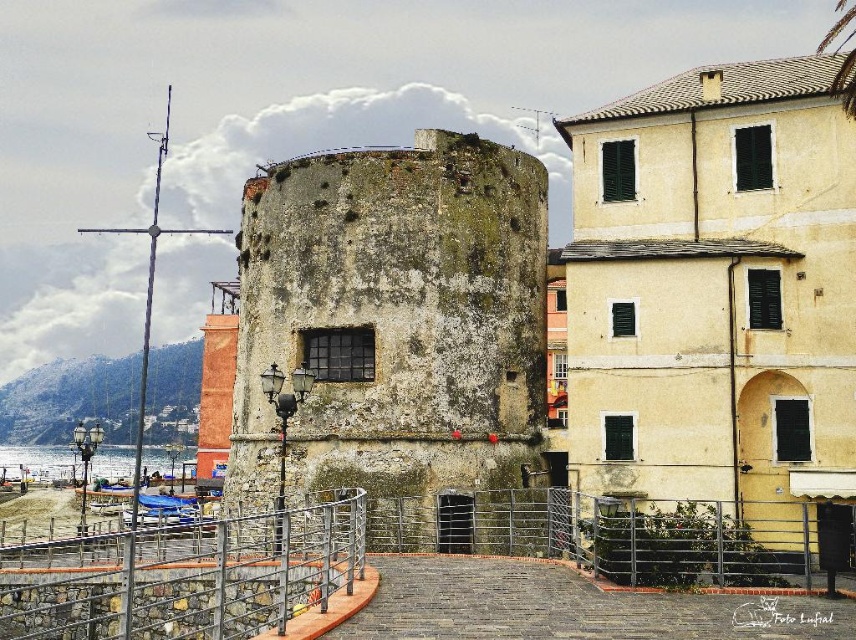
Is metallic gray railing at lower center positioned at the back of clear water at lower left?

No, it is not.

What do you see at coordinates (189, 577) in the screenshot? This screenshot has height=640, width=856. I see `metallic gray railing at lower center` at bounding box center [189, 577].

Does point (175, 540) lie in front of point (128, 472)?

Yes, point (175, 540) is closer to viewer.

This screenshot has height=640, width=856. What are the coordinates of `metallic gray railing at lower center` in the screenshot? It's located at (189, 577).

Is yellowish concrete building at center to the left of weathered stone tower at center from the viewer's perspective?

In fact, yellowish concrete building at center is to the right of weathered stone tower at center.

Which is behind, point (718, 150) or point (330, 451)?

The point (718, 150) is behind.

Identify the location of yellowish concrete building at center. This screenshot has height=640, width=856. (715, 292).

Which is above, yellowish concrete building at center or clear water at lower left?

yellowish concrete building at center

Does point (818, 339) come farther from viewer compared to point (183, 458)?

No, it is not.

From the picture: Who is more distant from viewer, (723, 259) or (98, 461)?

The point (98, 461) is more distant.

Where is `yellowish concrete building at center`? This screenshot has width=856, height=640. yellowish concrete building at center is located at coordinates (715, 292).